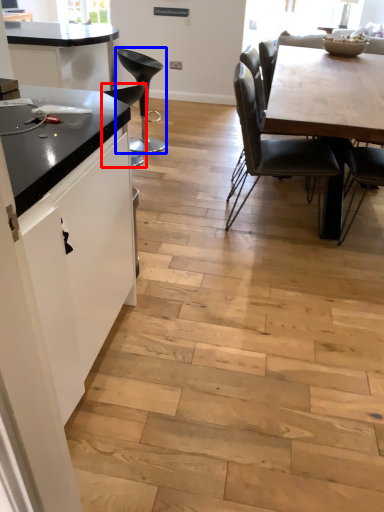
Question: Among these objects, which one is farthest to the camera, chair (highlighted by a red box) or chair (highlighted by a blue box)?

Choices:
 (A) chair
 (B) chair

Answer: (B)